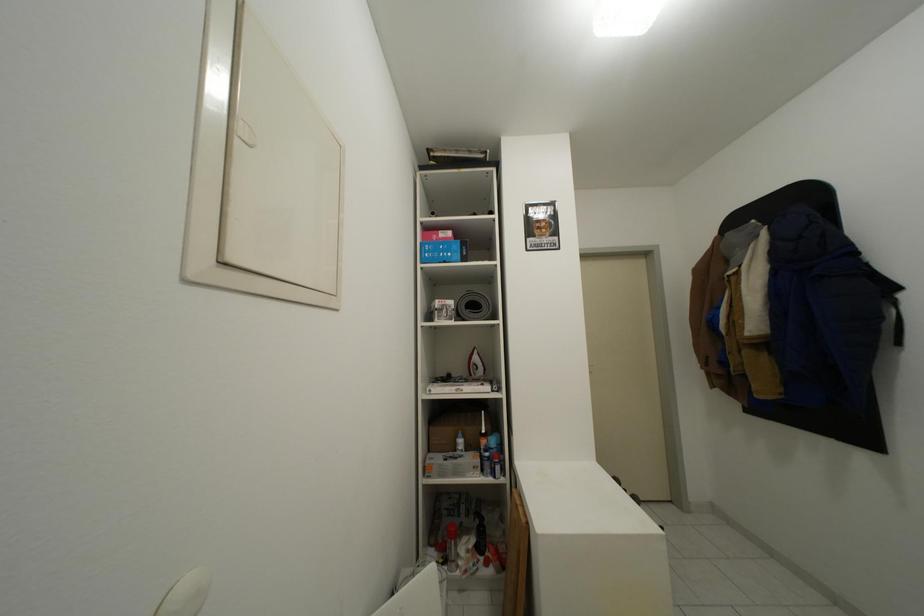
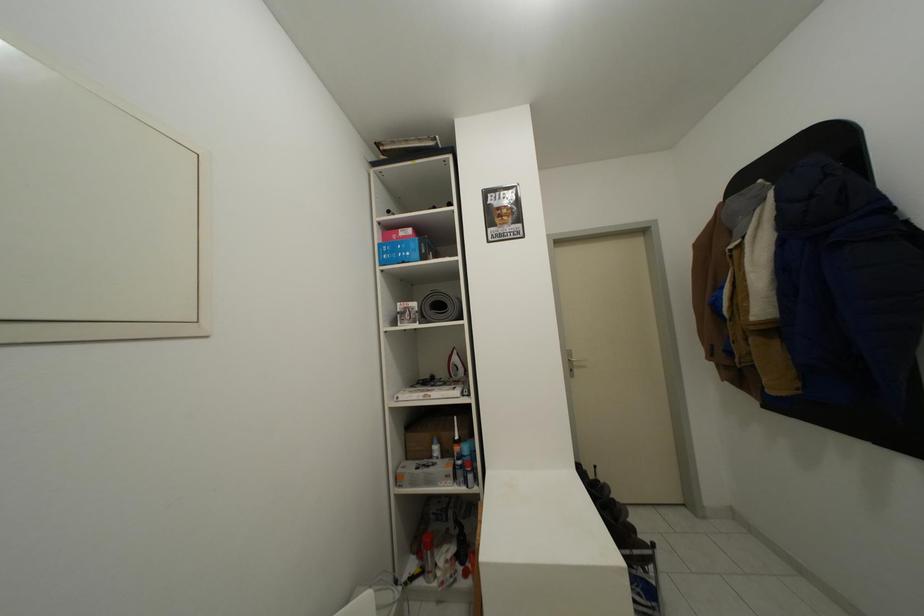
Question: The images are taken continuously from a first-person perspective. In which direction is your viewpoint rotating?

Choices:
 (A) Left
 (B) Right
 (C) Up
 (D) Down

Answer: (A)